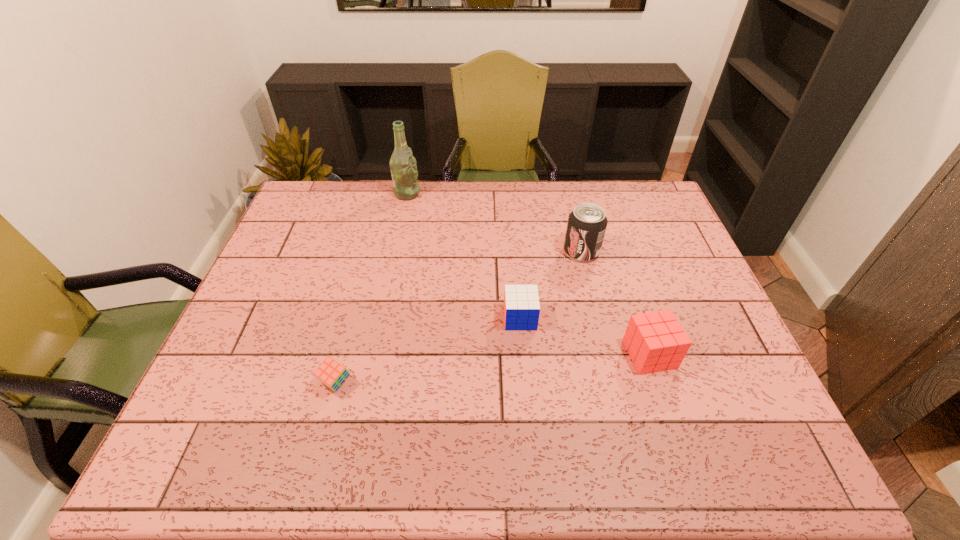
At what (x,y) coordinates should I click in order to perform the action: click on vacant region that satisfies the following two spatial constraints: 1. on the surface of the farthest object; 2. on the left side of the third object from right to left. Please return your answer as a coordinate pair (x, y). Looking at the image, I should click on (382, 318).

This screenshot has width=960, height=540. Identify the location of vacant space that satisfies the following two spatial constraints: 1. on the surface of the farthest object; 2. on the front side of the shortest cube. tap(369, 382).

At what (x,y) coordinates should I click in order to perform the action: click on free space that satisfies the following two spatial constraints: 1. on the surface of the farthest cube; 2. on the right side of the farthest object. Please return your answer as a coordinate pair (x, y). Looking at the image, I should click on (382, 318).